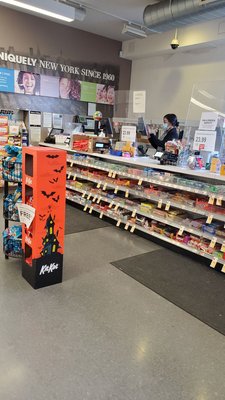
The width and height of the screenshot is (225, 400). What are the coordinates of `ceiling` in the screenshot? It's located at (131, 8).